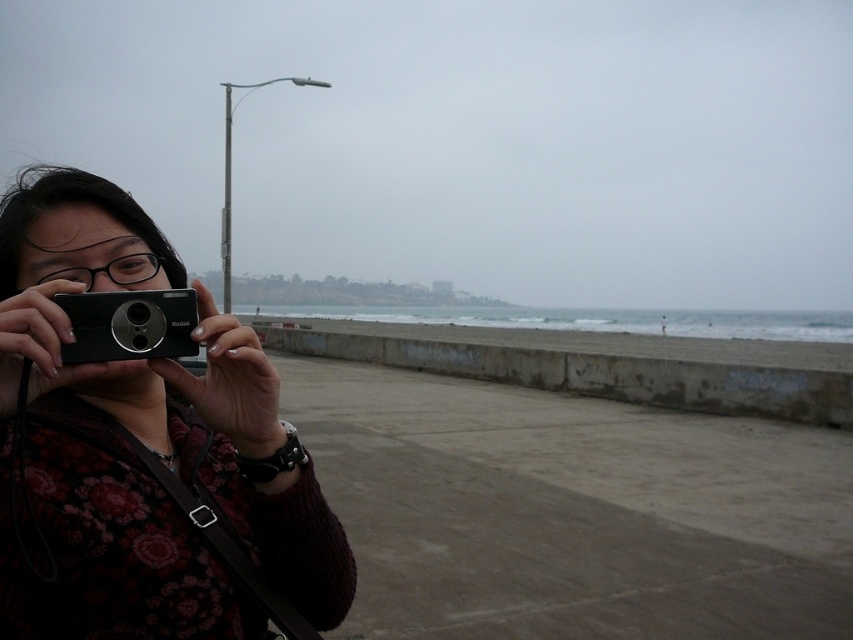
Is point (61, 616) less distant than point (64, 292)?

That is False.

Does point (223, 579) come farther from viewer compared to point (172, 352)?

Yes, point (223, 579) is behind point (172, 352).

The height and width of the screenshot is (640, 853). What are the coordinates of `matte black camera at left` in the screenshot? It's located at (140, 444).